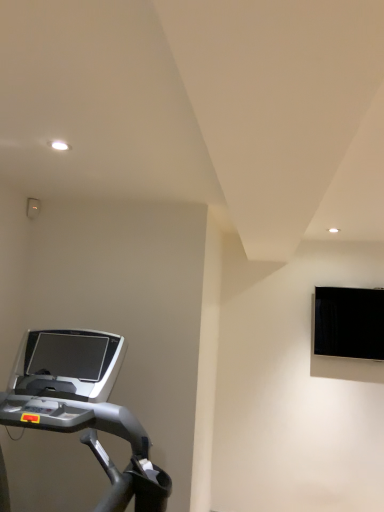
Question: Considering the relative sizes of silver metallic treadmill at lower left and black glossy monitor at upper right in the image provided, is silver metallic treadmill at lower left wider than black glossy monitor at upper right?

Choices:
 (A) yes
 (B) no

Answer: (A)

Question: Considering the relative sizes of silver metallic treadmill at lower left and black glossy monitor at upper right in the image provided, is silver metallic treadmill at lower left bigger than black glossy monitor at upper right?

Choices:
 (A) yes
 (B) no

Answer: (A)

Question: Is silver metallic treadmill at lower left placed right next to black glossy monitor at upper right?

Choices:
 (A) no
 (B) yes

Answer: (A)

Question: Is silver metallic treadmill at lower left oriented towards black glossy monitor at upper right?

Choices:
 (A) yes
 (B) no

Answer: (B)

Question: Considering the relative sizes of silver metallic treadmill at lower left and black glossy monitor at upper right in the image provided, is silver metallic treadmill at lower left shorter than black glossy monitor at upper right?

Choices:
 (A) yes
 (B) no

Answer: (B)

Question: Is silver metallic treadmill at lower left smaller than black glossy monitor at upper right?

Choices:
 (A) yes
 (B) no

Answer: (B)

Question: Is black glossy monitor at upper right oriented towards silver metallic treadmill at lower left?

Choices:
 (A) no
 (B) yes

Answer: (A)

Question: Is black glossy monitor at upper right completely or partially outside of silver metallic treadmill at lower left?

Choices:
 (A) yes
 (B) no

Answer: (A)

Question: From the image's perspective, would you say black glossy monitor at upper right is positioned over silver metallic treadmill at lower left?

Choices:
 (A) no
 (B) yes

Answer: (B)

Question: From the image's perspective, would you say black glossy monitor at upper right is shown under silver metallic treadmill at lower left?

Choices:
 (A) yes
 (B) no

Answer: (B)

Question: Is black glossy monitor at upper right wider than silver metallic treadmill at lower left?

Choices:
 (A) yes
 (B) no

Answer: (B)

Question: From a real-world perspective, is black glossy monitor at upper right beneath silver metallic treadmill at lower left?

Choices:
 (A) yes
 (B) no

Answer: (B)

Question: Is black glossy monitor at upper right wider or thinner than silver metallic treadmill at lower left?

Choices:
 (A) wide
 (B) thin

Answer: (B)